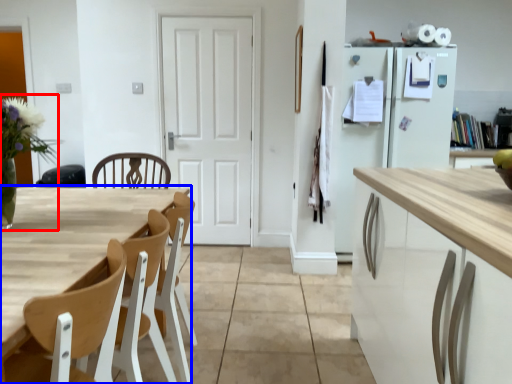
Question: Which object appears farthest to the camera in this image, floral arrangement (highlighted by a red box) or table (highlighted by a blue box)?

Choices:
 (A) floral arrangement
 (B) table

Answer: (A)